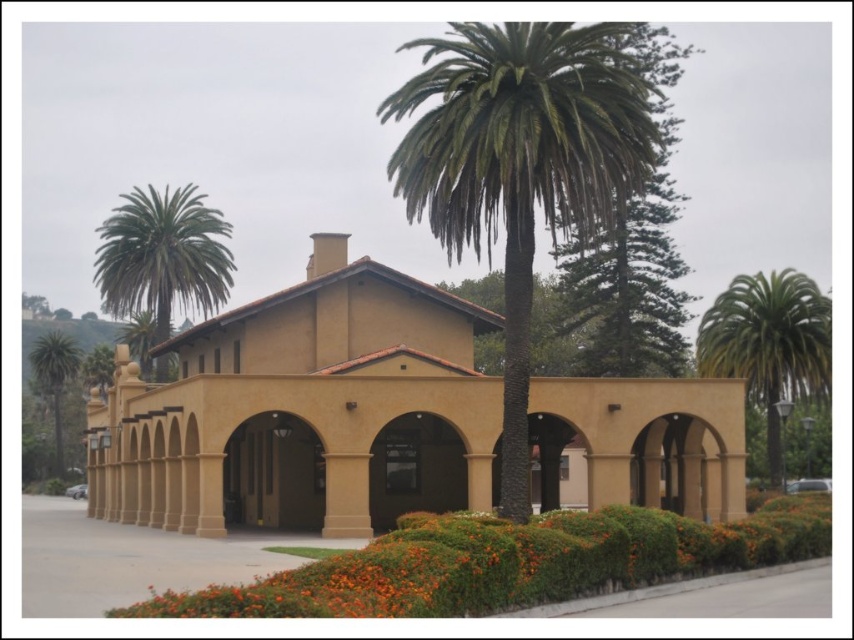
You are standing in front of the Spanish Colonial Revival building and want to take a photo of the green leafy palm tree at right. If your camera has a maximum focus range of 40 meters, will you be able to focus on the tree?

The green leafy palm tree at right is 43.74 meters away from the viewer, which exceeds the camera maximum focus range of 40 meters. Therefore, the camera cannot focus on the tree.